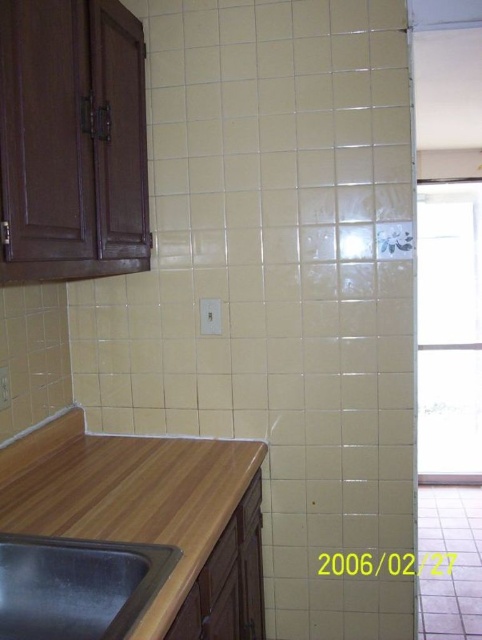
Who is higher up, wooden counter at lower left or black stainless steel sink at lower left?

black stainless steel sink at lower left

Does wooden counter at lower left come in front of black stainless steel sink at lower left?

That is False.

Is point (94, 461) positioned behind point (95, 620)?

Yes, point (94, 461) is farther from viewer.

Find the location of a particular element. Image resolution: width=482 pixels, height=640 pixels. wooden counter at lower left is located at coordinates (129, 496).